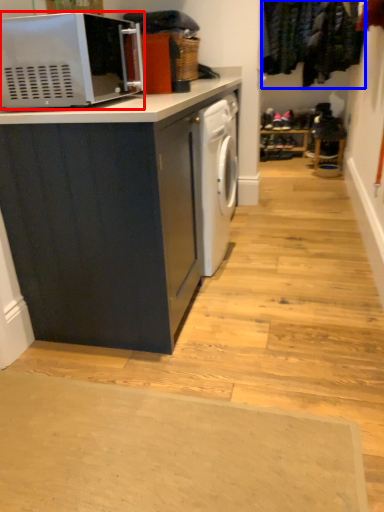
Question: Which point is further to the camera, microwave oven (highlighted by a red box) or laundry (highlighted by a blue box)?

Choices:
 (A) microwave oven
 (B) laundry

Answer: (B)